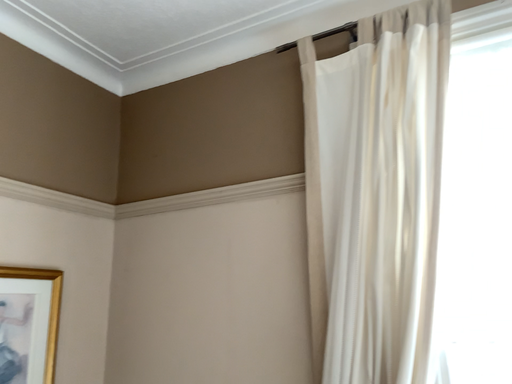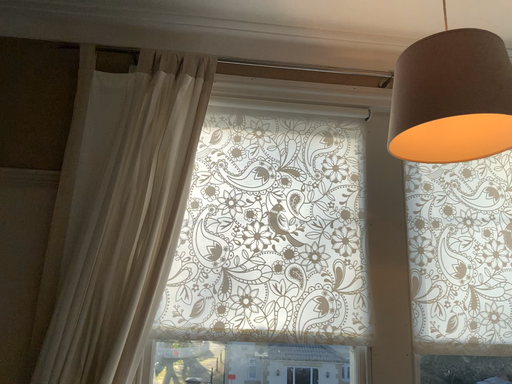
Question: Which way did the camera rotate in the video?

Choices:
 (A) rotated left
 (B) rotated right

Answer: (B)